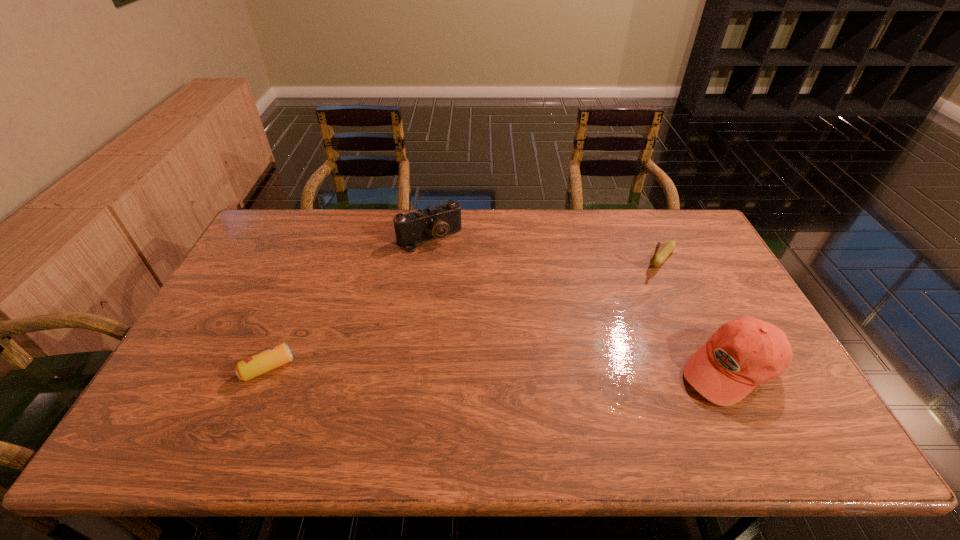
Find the location of a particular element. The height and width of the screenshot is (540, 960). vacant space at the far edge of the desktop is located at coordinates (611, 243).

Find the location of `free region at the near edge of the desktop`. free region at the near edge of the desktop is located at coordinates (430, 394).

Find the location of `free region at the left edge of the desktop`. free region at the left edge of the desktop is located at coordinates (227, 332).

Where is `vacant space at the right edge of the desktop`? The image size is (960, 540). vacant space at the right edge of the desktop is located at coordinates (718, 275).

The image size is (960, 540). I want to click on free spot at the far left corner of the desktop, so click(x=256, y=249).

In the image, there is a desktop. Identify the location of free space at the near left corner. (192, 381).

Where is `blank space at the far right corner of the desktop`? The width and height of the screenshot is (960, 540). blank space at the far right corner of the desktop is located at coordinates (648, 209).

In the image, there is a desktop. Where is `vacant space at the near right corner`? The height and width of the screenshot is (540, 960). vacant space at the near right corner is located at coordinates (784, 404).

Find the location of a particular element. The height and width of the screenshot is (540, 960). free area in between the tallest object and the leftmost object is located at coordinates (499, 368).

Identify the location of blank region between the shortest object and the camera. (348, 303).